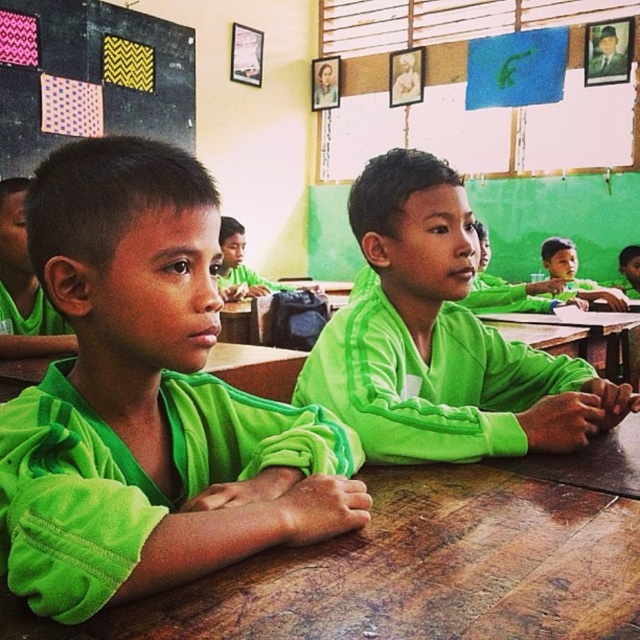
Question: Which object appears closest to the camera in this image?

Choices:
 (A) green fleece jacket at center
 (B) patterned fabric at upper left
 (C) green matte jacket at left

Answer: (A)

Question: Is green fleece jacket at center thinner than patterned fabric at upper left?

Choices:
 (A) yes
 (B) no

Answer: (A)

Question: Estimate the real-world distances between objects in this image. Which object is closer to the green fleece jacket at center?

Choices:
 (A) green matte jacket at center
 (B) patterned fabric at upper left
 (C) green matte jacket at left

Answer: (A)

Question: Which point is closer to the camera?

Choices:
 (A) (262, 438)
 (B) (417, 211)

Answer: (A)

Question: Can you confirm if patterned fabric at upper left is positioned to the right of green matte jacket at left?

Choices:
 (A) yes
 (B) no

Answer: (B)

Question: Is green matte jacket at center to the right of green matte jacket at left from the viewer's perspective?

Choices:
 (A) no
 (B) yes

Answer: (B)